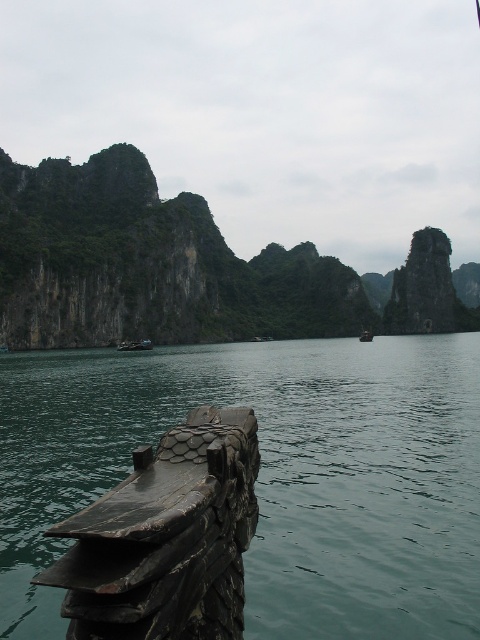
Which is behind, point (96, 275) or point (367, 339)?

The point (367, 339) is behind.

Does point (8, 273) come behind point (360, 332)?

No.

Who is more forward, (136, 232) or (364, 340)?

Point (364, 340) is more forward.

Image resolution: width=480 pixels, height=640 pixels. I want to click on green rock formation at center, so click(x=182, y=268).

Between point (252, 300) and point (123, 340), which one is positioned behind?

Positioned behind is point (252, 300).

Consider the image. Is green rock formation at center shorter than dark green wooden boat at center?

No.

The height and width of the screenshot is (640, 480). What do you see at coordinates (182, 268) in the screenshot? I see `green rock formation at center` at bounding box center [182, 268].

What are the coordinates of `green rock formation at center` in the screenshot? It's located at (182, 268).

Which is more to the right, dark green wooden boat at center or wooden boat at center?

From the viewer's perspective, wooden boat at center appears more on the right side.

Can you confirm if dark green wooden boat at center is thinner than wooden boat at center?

Yes, dark green wooden boat at center is thinner than wooden boat at center.

What do you see at coordinates (134, 346) in the screenshot? I see `dark green wooden boat at center` at bounding box center [134, 346].

Locate an element on the screen. This screenshot has height=640, width=480. dark green wooden boat at center is located at coordinates (134, 346).